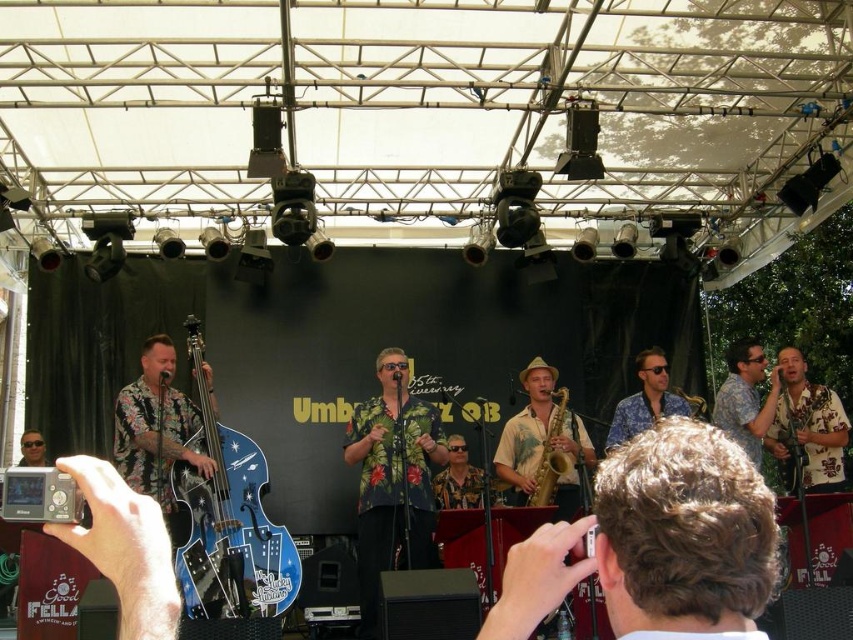
Does point (543, 468) come closer to viewer compared to point (752, 429)?

That is True.

Which is behind, point (569, 444) or point (740, 420)?

The point (740, 420) is more distant.

Locate an element on the screen. floral fabric saxophone at center is located at coordinates (543, 445).

Is blue glossy electric guitar at left to the left of gold metallic saxophone at center from the viewer's perspective?

Indeed, blue glossy electric guitar at left is positioned on the left side of gold metallic saxophone at center.

Who is positioned more to the left, blue glossy electric guitar at left or gold metallic saxophone at center?

From the viewer's perspective, blue glossy electric guitar at left appears more on the left side.

Which is in front, point (268, 595) or point (556, 422)?

Point (268, 595) is in front.

Where is `blue glossy electric guitar at left`? The image size is (853, 640). blue glossy electric guitar at left is located at coordinates (229, 522).

Does blue glossy electric guitar at left have a larger size compared to floral shirt at center?

Correct, blue glossy electric guitar at left is larger in size than floral shirt at center.

How far apart are blue glossy electric guitar at left and floral shirt at center?

A distance of 4.04 meters exists between blue glossy electric guitar at left and floral shirt at center.

Where is `blue glossy electric guitar at left`? This screenshot has width=853, height=640. blue glossy electric guitar at left is located at coordinates click(x=229, y=522).

Find the location of a particular element. This screenshot has width=853, height=640. blue glossy electric guitar at left is located at coordinates (229, 522).